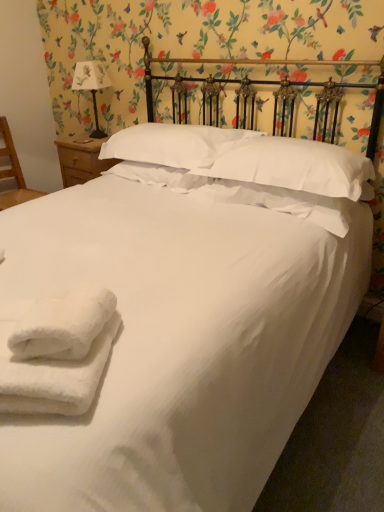
Question: Is white fluffy towels at lower left next to wooden chair at left?

Choices:
 (A) yes
 (B) no

Answer: (B)

Question: From the image's perspective, is white fluffy towels at lower left located beneath wooden chair at left?

Choices:
 (A) yes
 (B) no

Answer: (A)

Question: Is white fluffy towels at lower left not within wooden chair at left?

Choices:
 (A) no
 (B) yes

Answer: (B)

Question: Can you confirm if white fluffy towels at lower left is bigger than wooden chair at left?

Choices:
 (A) no
 (B) yes

Answer: (A)

Question: Is white fluffy towels at lower left turned away from wooden chair at left?

Choices:
 (A) no
 (B) yes

Answer: (B)

Question: Would you say white textured pillow at center, positioned as the 2th pillow in right-to-left order, is to the left or to the right of wooden chair at left in the picture?

Choices:
 (A) right
 (B) left

Answer: (A)

Question: Considering their positions, is white textured pillow at center, the 2th pillow when ordered from left to right, located in front of or behind wooden chair at left?

Choices:
 (A) behind
 (B) front

Answer: (B)

Question: From the image's perspective, is white textured pillow at center, the 2th pillow when ordered from left to right, positioned above or below wooden chair at left?

Choices:
 (A) below
 (B) above

Answer: (A)

Question: From their relative heights in the image, would you say white textured pillow at center, positioned as the 2th pillow in right-to-left order, is taller or shorter than wooden chair at left?

Choices:
 (A) tall
 (B) short

Answer: (B)

Question: Considering the positions of point (9, 174) and point (172, 160), is point (9, 174) closer or farther from the camera than point (172, 160)?

Choices:
 (A) closer
 (B) farther

Answer: (B)

Question: In the image, is wooden chair at left on the left side or the right side of white soft pillow at center, which is counted as the third pillow, starting from the right?

Choices:
 (A) left
 (B) right

Answer: (A)

Question: In terms of width, does wooden chair at left look wider or thinner when compared to white soft pillow at center, the first pillow from the left?

Choices:
 (A) thin
 (B) wide

Answer: (B)

Question: From the image's perspective, is wooden chair at left positioned above or below white soft pillow at center, the first pillow from the left?

Choices:
 (A) below
 (B) above

Answer: (A)

Question: From a real-world perspective, relative to white textured pillow at center, positioned as the 2th pillow in right-to-left order, is white paper-covered lampshade at upper left vertically above or below?

Choices:
 (A) above
 (B) below

Answer: (A)

Question: Relative to white textured pillow at center, the 2th pillow when ordered from left to right, is white paper-covered lampshade at upper left in front or behind?

Choices:
 (A) behind
 (B) front

Answer: (A)